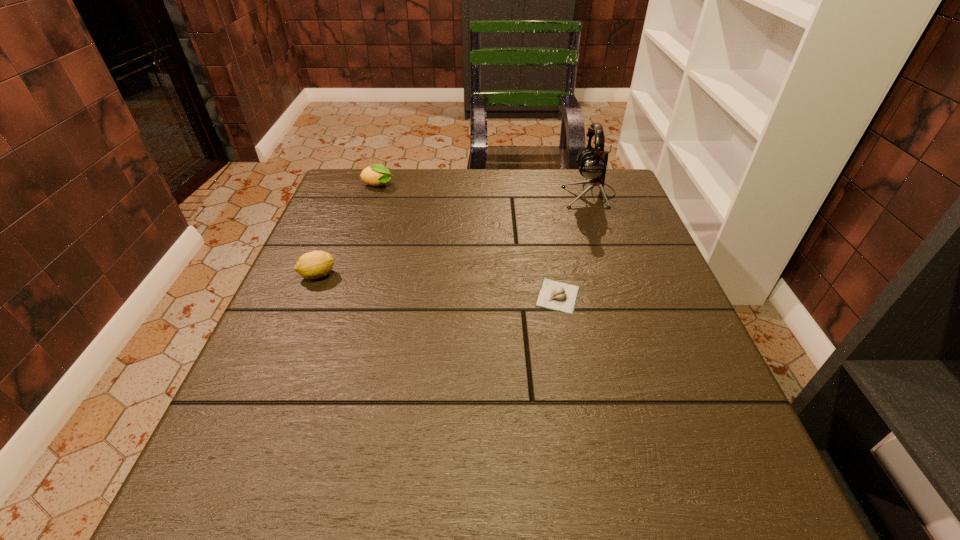
This screenshot has height=540, width=960. In the image, there is a desktop. What are the coordinates of `vacant space at the near left corner` in the screenshot? It's located at (227, 476).

You are a GUI agent. You are given a task and a screenshot of the screen. Output one action in this format:
    pyautogui.click(x=<x>, y=<y>)
    Task: Click on the vacant space at the far right corner
    The height and width of the screenshot is (540, 960).
    Given the screenshot: What is the action you would take?
    pyautogui.click(x=586, y=186)

You are a GUI agent. You are given a task and a screenshot of the screen. Output one action in this format:
    pyautogui.click(x=<x>, y=<y>)
    Task: Click on the vacant area that lies between the nearer lemon and the tallest object
    
    Given the screenshot: What is the action you would take?
    pyautogui.click(x=454, y=234)

Where is `vacant space in between the tallest object and the farther lemon`? vacant space in between the tallest object and the farther lemon is located at coordinates (484, 190).

You are a GUI agent. You are given a task and a screenshot of the screen. Output one action in this format:
    pyautogui.click(x=<x>, y=<y>)
    Task: Click on the free space between the farther lemon and the earphone
    
    Given the screenshot: What is the action you would take?
    pyautogui.click(x=484, y=190)

The height and width of the screenshot is (540, 960). I want to click on vacant point located between the shortest object and the farther lemon, so click(x=468, y=241).

Where is `free space that is in between the farther lemon and the nearer lemon`? free space that is in between the farther lemon and the nearer lemon is located at coordinates (348, 231).

The width and height of the screenshot is (960, 540). I want to click on vacant point located between the nearer lemon and the tallest object, so click(x=454, y=234).

I want to click on vacant space in between the third object from left to right and the earphone, so click(x=574, y=245).

Locate an element on the screen. The height and width of the screenshot is (540, 960). free space that is in between the earphone and the second object from right to left is located at coordinates (574, 245).